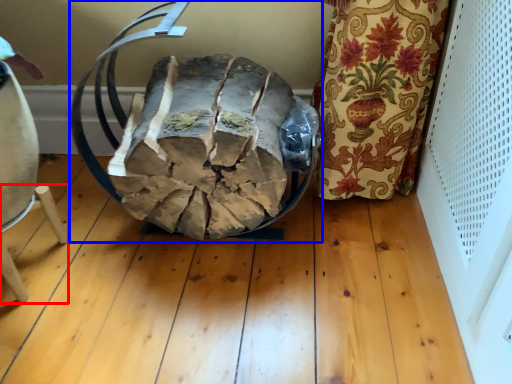
Question: Among these objects, which one is nearest to the camera, furniture (highlighted by a red box) or bean bag chair (highlighted by a blue box)?

Choices:
 (A) furniture
 (B) bean bag chair

Answer: (B)